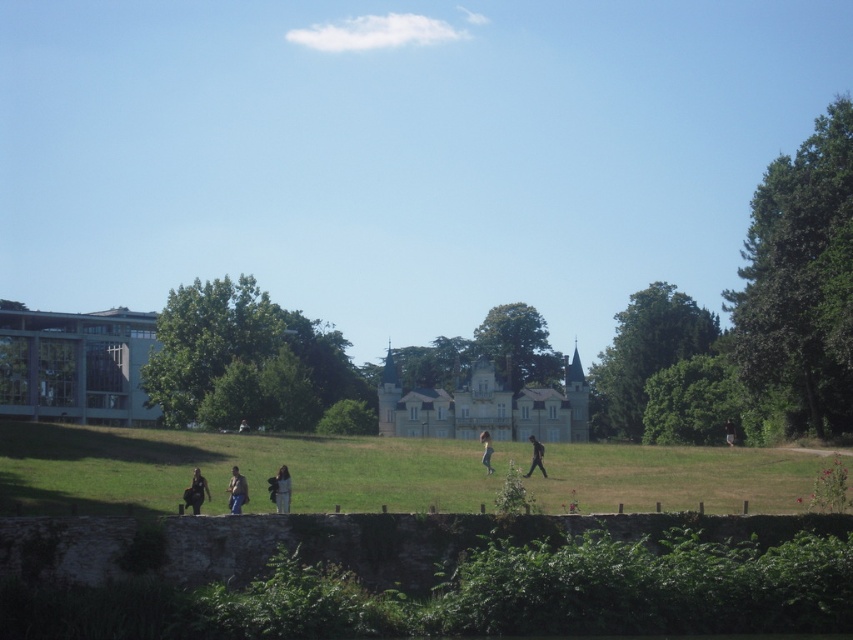
You are standing in the serene outdoor scene and want to approach the black fabric person at center without getting too close to the dark brown leather jacket at lower left. Which direction should you move to stay to the right of the jacket while heading towards the person?

To stay to the right of the dark brown leather jacket at lower left while approaching the black fabric person at center, you should move towards the right side of the jacket, as the jacket is on the left of the person. This way, you remain between the jacket and the person, maintaining the correct direction.

You are a photographer planning to take a group photo of the black fabric person at center and the green grassy field at lower center. Which one should you focus on if you want to capture the larger subject in the frame?

The green grassy field at lower center is bigger than the black fabric person at center, so you should focus on the green grassy field at lower center to capture the larger subject in the frame.